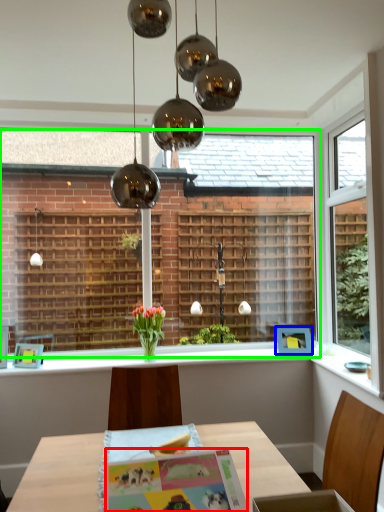
Question: Based on their relative distances, which object is nearer to postcard (highlighted by a red box)? Choose from picture frame (highlighted by a blue box) and bay window (highlighted by a green box).

Choices:
 (A) picture frame
 (B) bay window

Answer: (A)